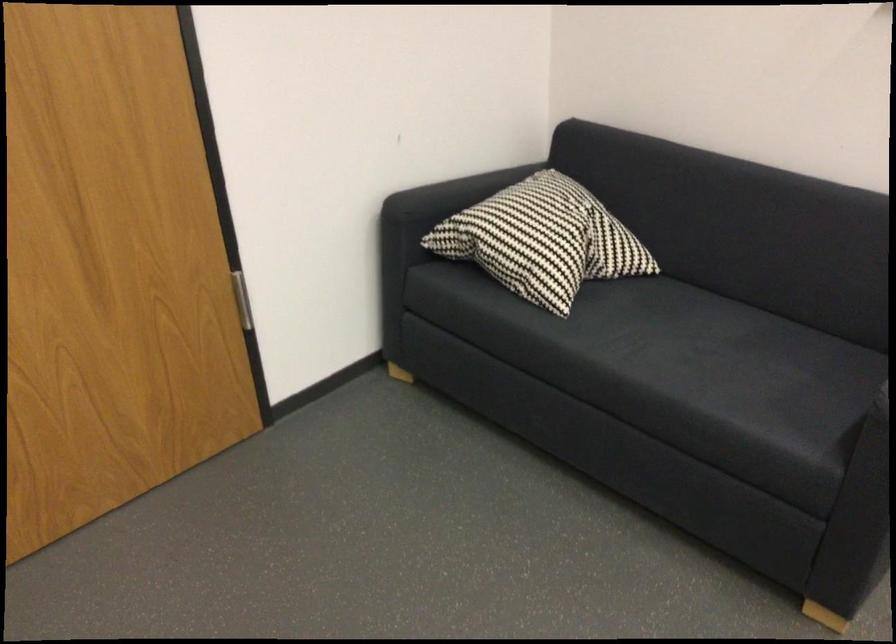
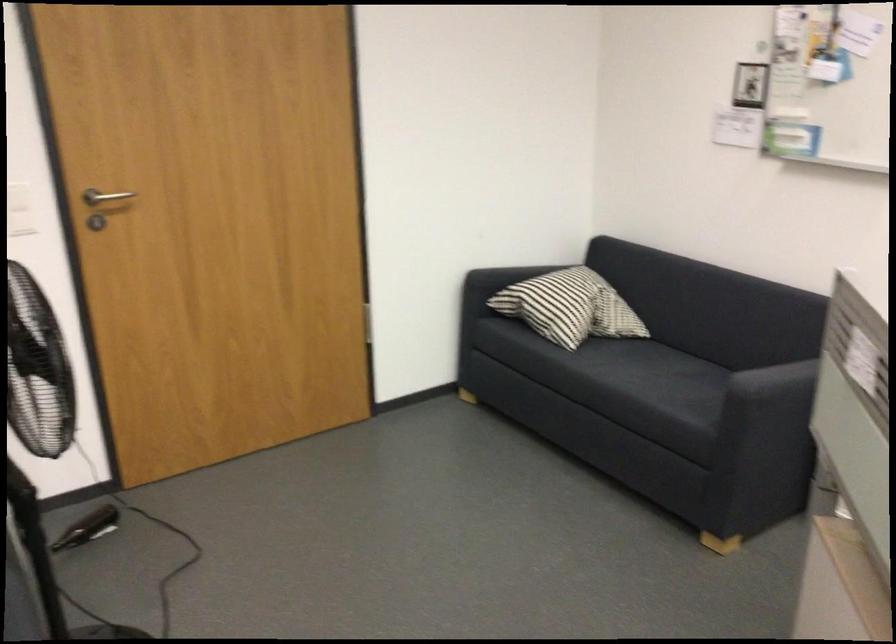
Locate, in the second image, the point that corresponds to [709,334] in the first image.

(668, 370)